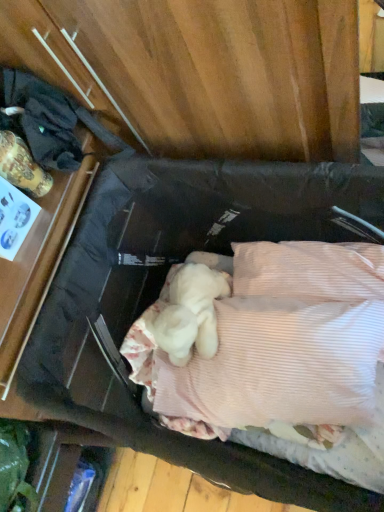
Question: From the image's perspective, is white soft blanket at center positioned above or below matte black backpack at left?

Choices:
 (A) above
 (B) below

Answer: (B)

Question: Relative to matte black backpack at left, is white soft blanket at center in front or behind?

Choices:
 (A) front
 (B) behind

Answer: (B)

Question: Considering the relative positions of white soft blanket at center and matte black backpack at left in the image provided, is white soft blanket at center to the left or to the right of matte black backpack at left?

Choices:
 (A) left
 (B) right

Answer: (B)

Question: From the image's perspective, relative to white soft blanket at center, is matte black backpack at left above or below?

Choices:
 (A) above
 (B) below

Answer: (A)

Question: In terms of size, does matte black backpack at left appear bigger or smaller than white soft blanket at center?

Choices:
 (A) small
 (B) big

Answer: (A)

Question: Do you think matte black backpack at left is within white soft blanket at center, or outside of it?

Choices:
 (A) inside
 (B) outside

Answer: (B)

Question: Is matte black backpack at left to the left or to the right of white soft blanket at center in the image?

Choices:
 (A) left
 (B) right

Answer: (A)